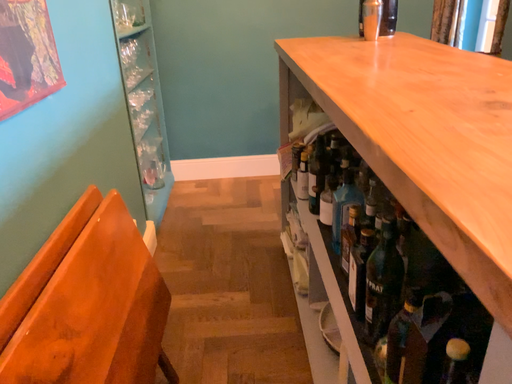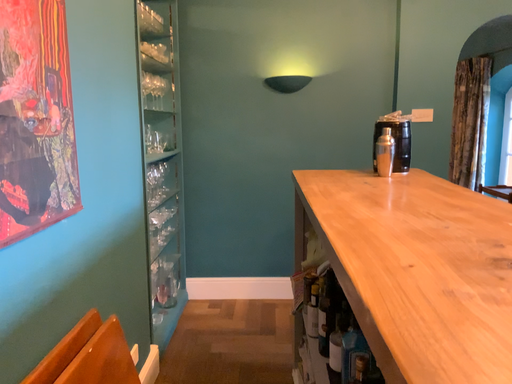
Question: How did the camera likely rotate when shooting the video?

Choices:
 (A) rotated upward
 (B) rotated downward

Answer: (A)